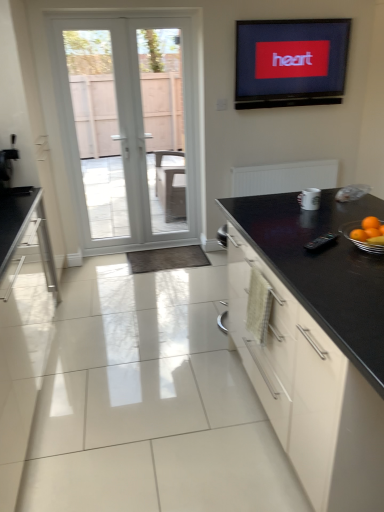
The height and width of the screenshot is (512, 384). In order to click on free location to the right of white ceramic mug at upper right, which ranks as the first appliance in back-to-front order in this screenshot , I will do `click(345, 206)`.